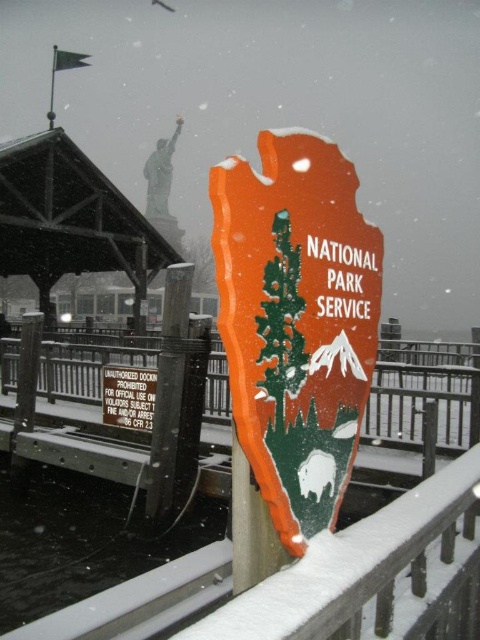
Question: Which of the following is the closest to the observer?

Choices:
 (A) brushed metal pole at center
 (B) wooden sign at center

Answer: (A)

Question: Can you confirm if brushed metal pole at center is wider than wooden sign at center?

Choices:
 (A) no
 (B) yes

Answer: (A)

Question: From the image, what is the correct spatial relationship of orange matte national park service sign at center in relation to wooden sign at center?

Choices:
 (A) above
 (B) below

Answer: (A)

Question: Which object appears closest to the camera in this image?

Choices:
 (A) brushed metal pole at center
 (B) orange matte national park service sign at center
 (C) wooden sign at center

Answer: (B)

Question: Observing the image, what is the correct spatial positioning of brushed metal pole at center in reference to wooden sign at center?

Choices:
 (A) right
 (B) left

Answer: (A)

Question: Among these objects, which one is nearest to the camera?

Choices:
 (A) brushed metal pole at center
 (B) orange matte national park service sign at center
 (C) wooden sign at center

Answer: (B)